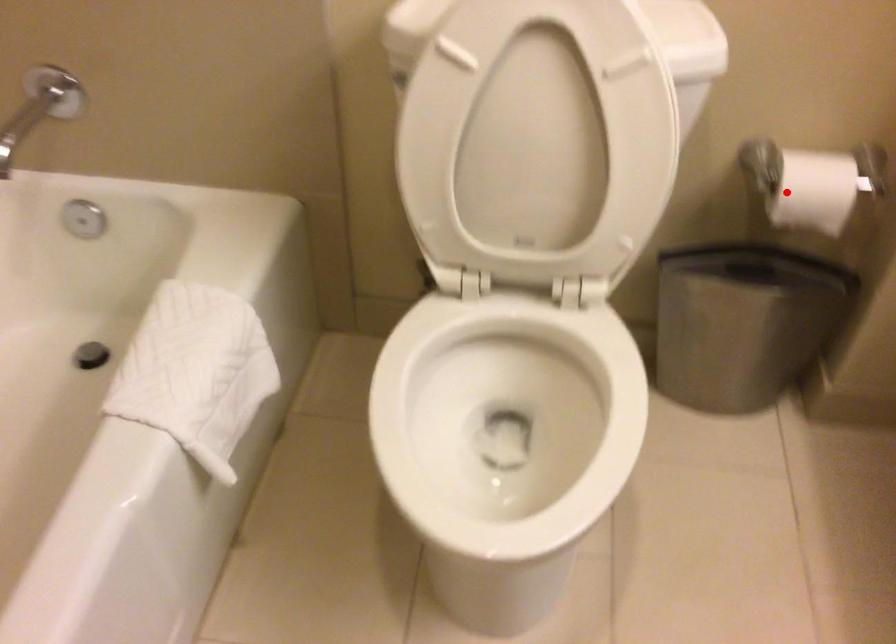
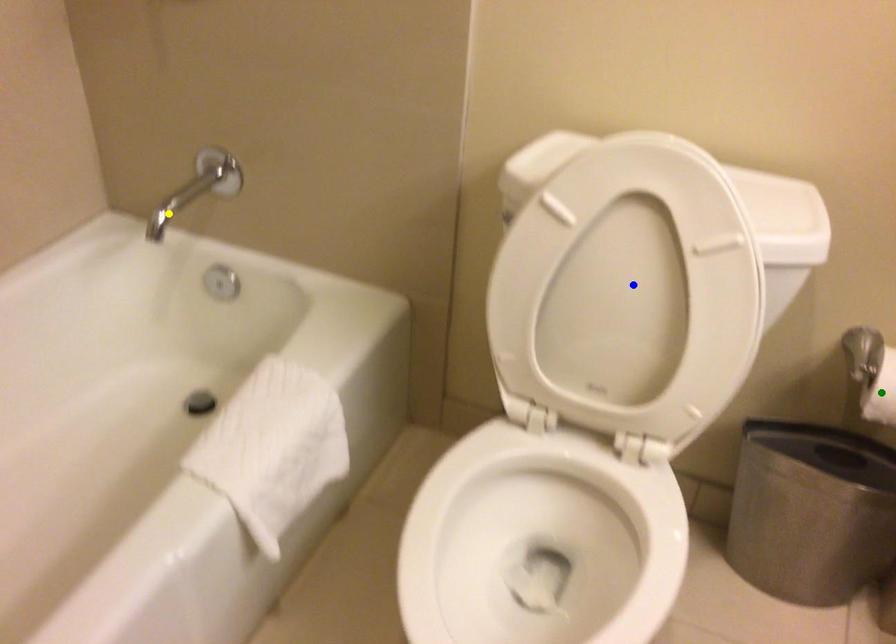
Question: I am providing you with two images of the same scene from different viewpoints. A red point is marked on the first image. You are given multiple points on the second image. In image 2, which mark is for the same physical point as the one in image 1?

Choices:
 (A) yellow point
 (B) blue point
 (C) green point

Answer: (C)